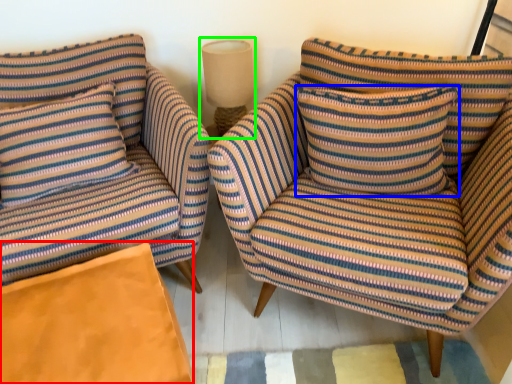
Question: Which object is positioned farthest from material (highlighted by a red box)? Select from pillow (highlighted by a blue box) and lamp (highlighted by a green box).

Choices:
 (A) pillow
 (B) lamp

Answer: (B)